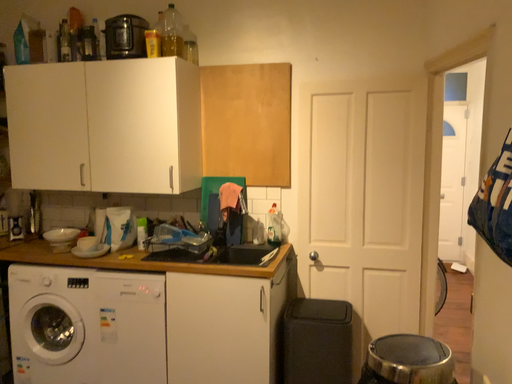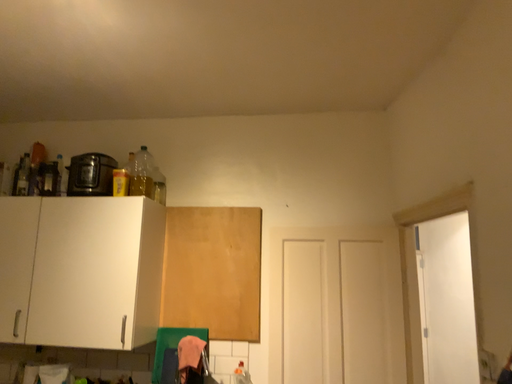
Question: Which way did the camera rotate in the video?

Choices:
 (A) rotated upward
 (B) rotated downward

Answer: (A)